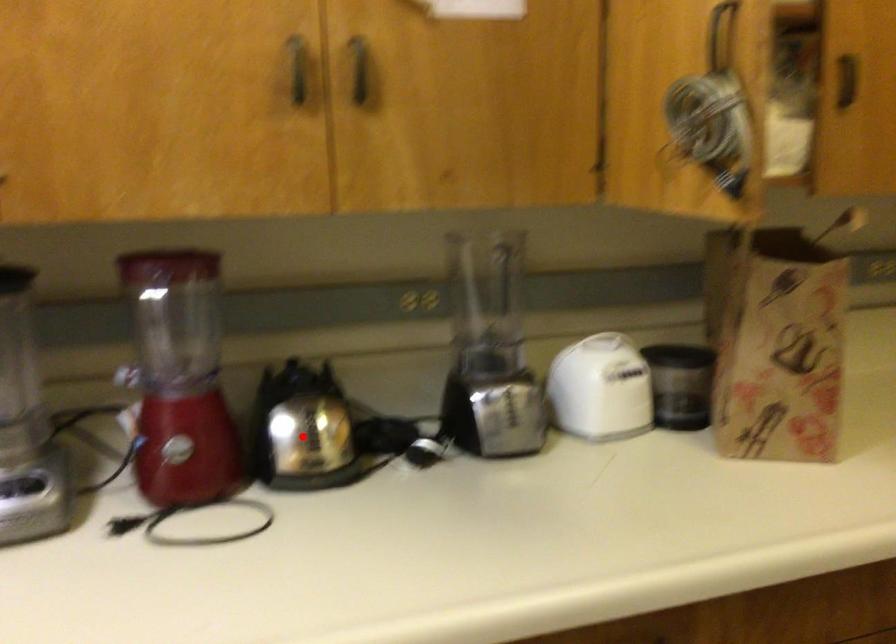
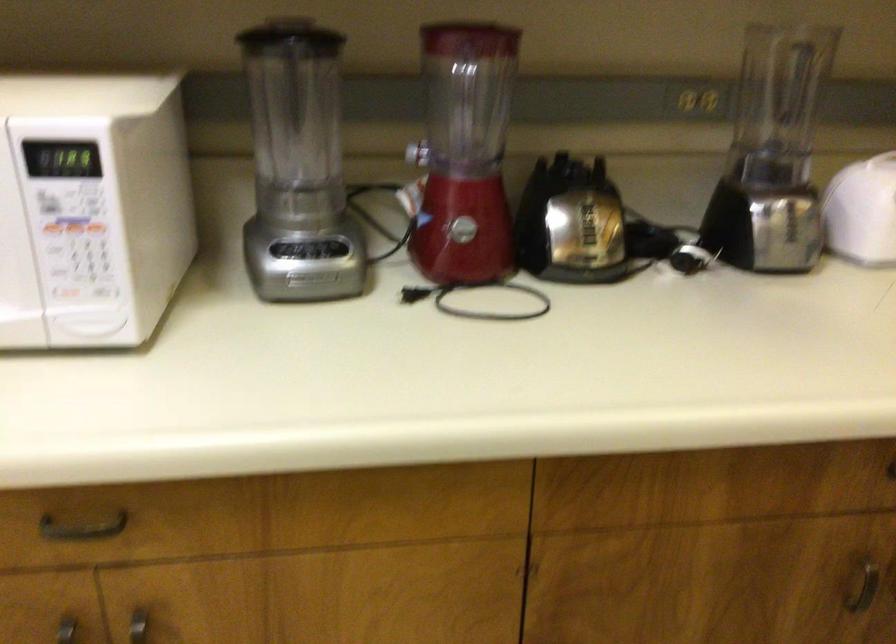
In the second image, find the point that corresponds to the highlighted location in the first image.

(580, 225)